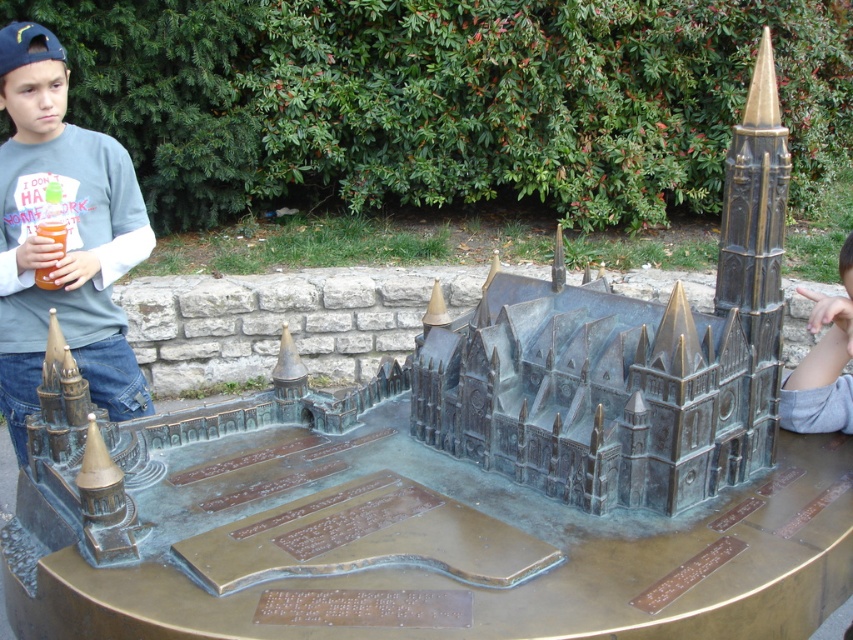
Question: Based on their relative distances, which object is farther from the translucent plastic cup at left?

Choices:
 (A) gray fabric hand at lower right
 (B) matte gray shirt at left

Answer: (A)

Question: Can you confirm if gray fabric hand at lower right is thinner than translucent plastic cup at left?

Choices:
 (A) no
 (B) yes

Answer: (A)

Question: Which point is closer to the camera taking this photo?

Choices:
 (A) (39, 291)
 (B) (36, 276)

Answer: (B)

Question: Does matte gray shirt at left have a lesser width compared to translucent plastic cup at left?

Choices:
 (A) yes
 (B) no

Answer: (B)

Question: Which point is closer to the camera taking this photo?

Choices:
 (A) (44, 248)
 (B) (807, 429)

Answer: (B)

Question: Does gray fabric hand at lower right appear under translucent plastic cup at left?

Choices:
 (A) no
 (B) yes

Answer: (B)